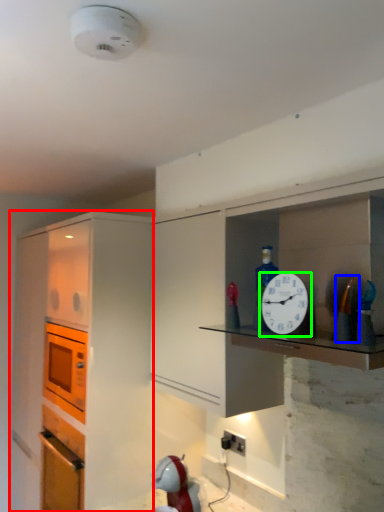
Question: Considering the real-world distances, which object is farthest from cabinetry (highlighted by a red box)? toy (highlighted by a blue box) or clock (highlighted by a green box)?

Choices:
 (A) toy
 (B) clock

Answer: (A)